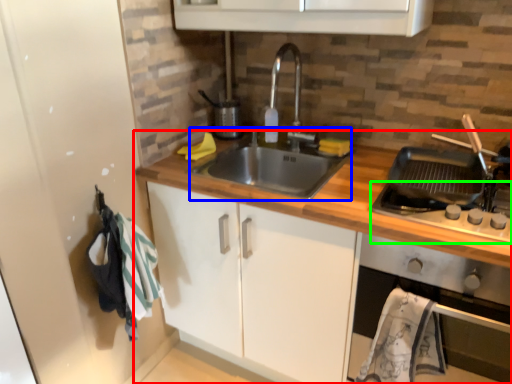
Question: Based on their relative distances, which object is nearer to countertop (highlighted by a red box)? Choose from sink (highlighted by a blue box) and gas stove (highlighted by a green box).

Choices:
 (A) sink
 (B) gas stove

Answer: (A)